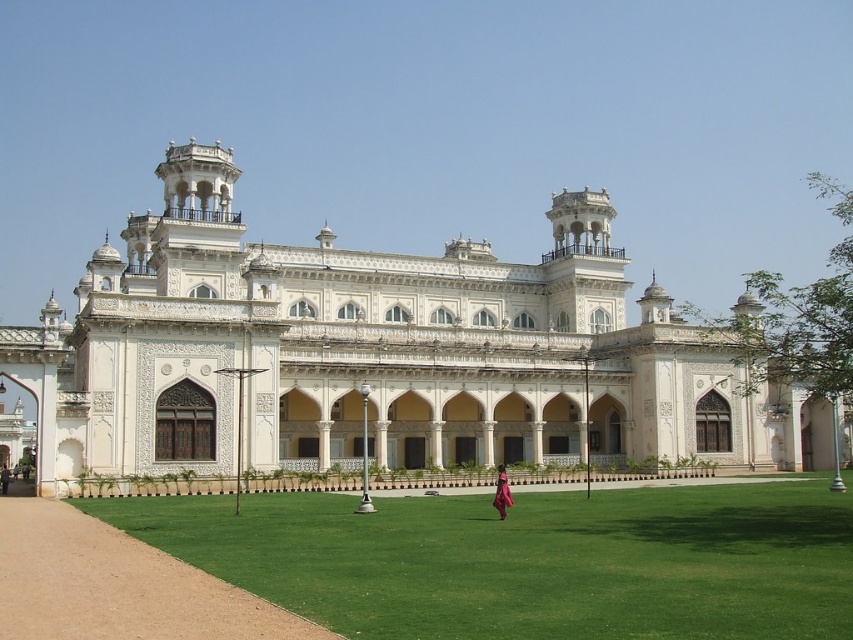
Question: Can you confirm if green grass at center is positioned below pink silk dress at center?

Choices:
 (A) no
 (B) yes

Answer: (A)

Question: Which of the following is the farthest from the observer?

Choices:
 (A) green grass at center
 (B) white marble palace at center

Answer: (B)

Question: Which point is farther to the camera?

Choices:
 (A) (511, 499)
 (B) (316, 356)
 (C) (405, 500)

Answer: (B)

Question: Can you confirm if white marble palace at center is thinner than green grass at center?

Choices:
 (A) no
 (B) yes

Answer: (A)

Question: Is white marble palace at center bigger than green grass at center?

Choices:
 (A) no
 (B) yes

Answer: (B)

Question: Which of the following is the farthest from the observer?

Choices:
 (A) pink silk dress at center
 (B) white marble palace at center
 (C) green grass at center

Answer: (B)